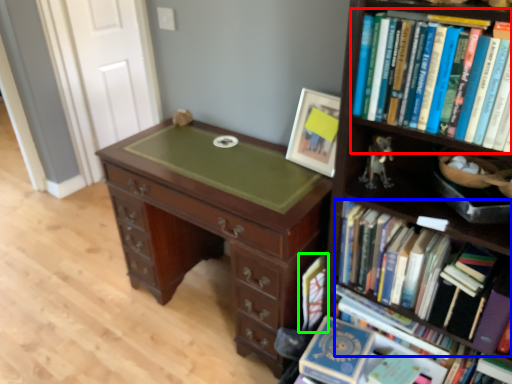
Question: Estimate the real-world distances between objects in this image. Which object is farther from book (highlighted by a red box), book (highlighted by a blue box) or book (highlighted by a green box)?

Choices:
 (A) book
 (B) book

Answer: (B)